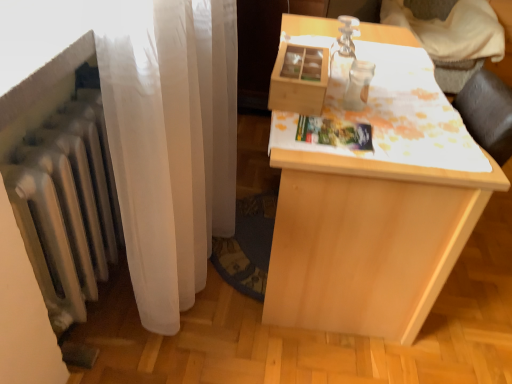
Question: Can you confirm if wooden table at upper right is smaller than light wood table at center?

Choices:
 (A) no
 (B) yes

Answer: (B)

Question: Does wooden table at upper right appear on the left side of light wood table at center?

Choices:
 (A) no
 (B) yes

Answer: (A)

Question: Does wooden table at upper right appear on the right side of light wood table at center?

Choices:
 (A) no
 (B) yes

Answer: (B)

Question: Does wooden table at upper right have a greater width compared to light wood table at center?

Choices:
 (A) yes
 (B) no

Answer: (A)

Question: Is wooden table at upper right shorter than light wood table at center?

Choices:
 (A) no
 (B) yes

Answer: (A)

Question: Is light wood table at center inside wooden table at upper right?

Choices:
 (A) yes
 (B) no

Answer: (B)

Question: Does light wood table at center have a lesser height compared to wooden table at upper right?

Choices:
 (A) yes
 (B) no

Answer: (A)

Question: Is light wood table at center turned away from wooden table at upper right?

Choices:
 (A) yes
 (B) no

Answer: (B)

Question: Is light wood table at center facing towards wooden table at upper right?

Choices:
 (A) no
 (B) yes

Answer: (A)

Question: From a real-world perspective, is light wood table at center over wooden table at upper right?

Choices:
 (A) no
 (B) yes

Answer: (A)

Question: Is light wood table at center surrounding wooden table at upper right?

Choices:
 (A) no
 (B) yes

Answer: (A)

Question: Are light wood table at center and wooden table at upper right beside each other?

Choices:
 (A) no
 (B) yes

Answer: (A)

Question: Is light wood table at center located within white sheer curtain at left?

Choices:
 (A) yes
 (B) no

Answer: (B)